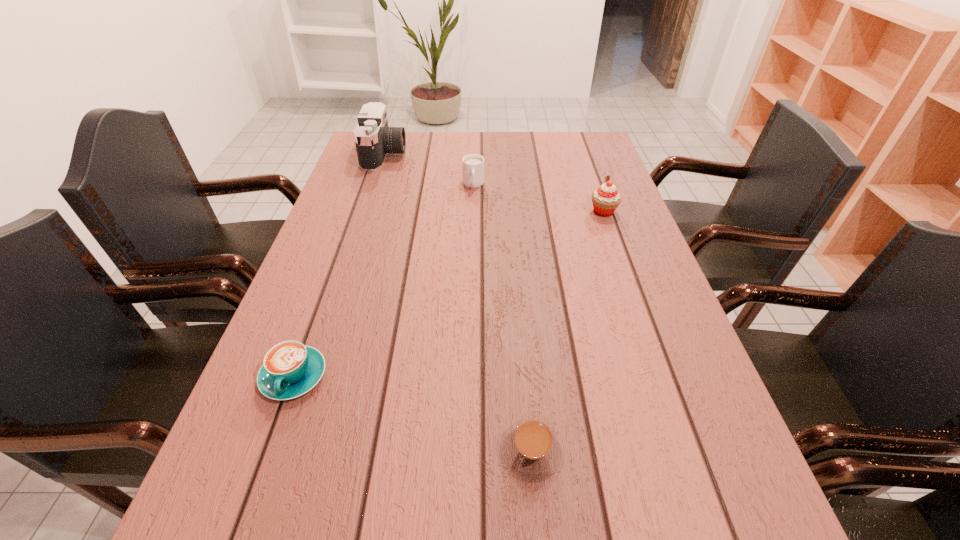
In the image, there is a desktop. Where is `vacant space at the far edge`? The height and width of the screenshot is (540, 960). vacant space at the far edge is located at coordinates (529, 139).

Identify the location of vacant region at the left edge of the desktop. (328, 437).

Where is `vacant space at the right edge of the desktop`? The height and width of the screenshot is (540, 960). vacant space at the right edge of the desktop is located at coordinates (581, 199).

Locate an element on the screen. The width and height of the screenshot is (960, 540). free spot at the far right corner of the desktop is located at coordinates (586, 134).

Identify the location of unoccupied position between the tallest object and the fourth object from left to right. (459, 303).

Find the location of a particular element. This screenshot has width=960, height=540. blank region between the camera and the second nearest object is located at coordinates (340, 265).

The image size is (960, 540). I want to click on empty space between the nearest cappuccino and the third object from left to right, so click(x=503, y=318).

Find the location of a particular element. free spot between the nearest object and the second cappuccino from left to right is located at coordinates (503, 318).

Where is `free space between the second nearest cappuccino and the farthest object`? free space between the second nearest cappuccino and the farthest object is located at coordinates (340, 265).

Where is `free space between the tallest cappuccino and the nearest cappuccino`? The width and height of the screenshot is (960, 540). free space between the tallest cappuccino and the nearest cappuccino is located at coordinates (503, 318).